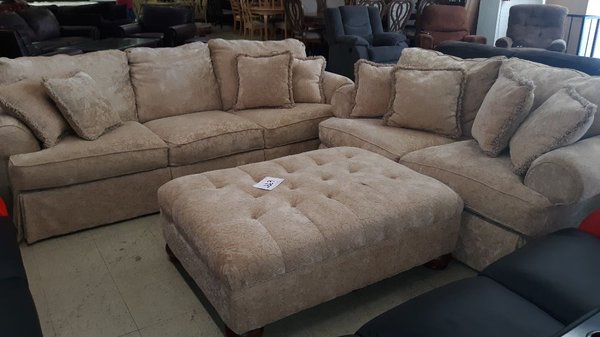
Locate an element on the screen. Image resolution: width=600 pixels, height=337 pixels. couch pillow is located at coordinates (79, 109), (43, 111), (271, 66), (408, 99), (496, 113), (556, 137), (380, 99), (280, 90), (305, 75).